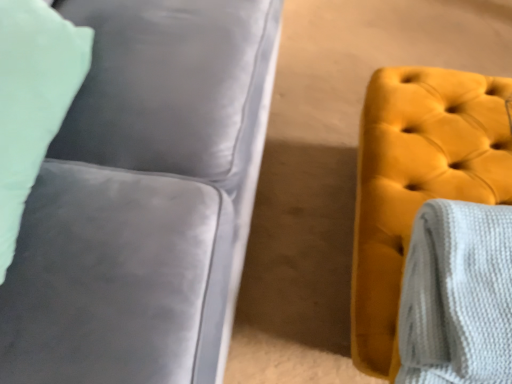
What do you see at coordinates (457, 295) in the screenshot? This screenshot has height=384, width=512. I see `white textured blanket at right` at bounding box center [457, 295].

Measure the distance between white textured blanket at right and camera.

27.69 inches.

At what (x,y) coordinates should I click in order to perform the action: click on velvet yellow ottoman at right. Please return your answer as a coordinate pair (x, y). The height and width of the screenshot is (384, 512). Looking at the image, I should click on (417, 183).

This screenshot has width=512, height=384. I want to click on furniture below the satin gray couch at left (from the image's perspective), so click(x=417, y=183).

Is velvet yellow ottoman at right positioned with its back to satin gray couch at left?

No, satin gray couch at left is not at the back of velvet yellow ottoman at right.

How different are the orientations of velvet yellow ottoman at right and satin gray couch at left in degrees?

88 degrees.

How distant is velvet yellow ottoman at right from white textured blanket at right?

A distance of 18.38 centimeters exists between velvet yellow ottoman at right and white textured blanket at right.

Considering the relative positions of velvet yellow ottoman at right and white textured blanket at right in the image provided, is velvet yellow ottoman at right to the right of white textured blanket at right from the viewer's perspective?

Yes.

From the image's perspective, which object appears higher, velvet yellow ottoman at right or white textured blanket at right?

velvet yellow ottoman at right.

You are a GUI agent. You are given a task and a screenshot of the screen. Output one action in this format:
    pyautogui.click(x=<x>, y=<y>)
    Task: Click on the blanket located above the velvet yellow ottoman at right (from a real-world perspective)
    The height and width of the screenshot is (384, 512).
    Given the screenshot: What is the action you would take?
    pyautogui.click(x=457, y=295)

From the picture: Is satin gray couch at left not within velvet yellow ottoman at right?

Indeed, satin gray couch at left is completely outside velvet yellow ottoman at right.

Between satin gray couch at left and velvet yellow ottoman at right, which one appears on the left side from the viewer's perspective?

satin gray couch at left is more to the left.

How much distance is there between satin gray couch at left and velvet yellow ottoman at right?

satin gray couch at left is 18.04 inches away from velvet yellow ottoman at right.

Considering the sizes of satin gray couch at left and velvet yellow ottoman at right in the image, is satin gray couch at left taller or shorter than velvet yellow ottoman at right?

Clearly, satin gray couch at left is taller compared to velvet yellow ottoman at right.

From a real-world perspective, is white textured blanket at right positioned under satin gray couch at left based on gravity?

Yes.

Does point (475, 325) lie behind point (78, 2)?

No, it is in front of (78, 2).

Between white textured blanket at right and satin gray couch at left, which one appears on the right side from the viewer's perspective?

white textured blanket at right is more to the right.

What's the angular difference between white textured blanket at right and velvet yellow ottoman at right's facing directions?

The facing directions of white textured blanket at right and velvet yellow ottoman at right are 1.46 degrees apart.

Is white textured blanket at right at the right side of velvet yellow ottoman at right?

No.

The width and height of the screenshot is (512, 384). I want to click on blanket that appears in front of the velvet yellow ottoman at right, so click(x=457, y=295).

Considering their positions, is white textured blanket at right located in front of or behind velvet yellow ottoman at right?

In the image, white textured blanket at right appears in front of velvet yellow ottoman at right.

Could you tell me if satin gray couch at left is turned towards white textured blanket at right?

Yes, satin gray couch at left faces towards white textured blanket at right.

Who is bigger, satin gray couch at left or white textured blanket at right?

satin gray couch at left.

Is satin gray couch at left surrounding white textured blanket at right?

No, satin gray couch at left does not contain white textured blanket at right.

Can you confirm if satin gray couch at left is wider than white textured blanket at right?

Yes.

The image size is (512, 384). Find the location of `studio couch above the velvet yellow ottoman at right (from a real-world perspective)`. studio couch above the velvet yellow ottoman at right (from a real-world perspective) is located at coordinates (143, 198).

This screenshot has width=512, height=384. Identify the location of blanket in front of the velvet yellow ottoman at right. (x=457, y=295).

Based on the photo, when comparing their distances from white textured blanket at right, does velvet yellow ottoman at right or satin gray couch at left seem further?

satin gray couch at left.

Which object lies nearer to the anchor point satin gray couch at left, velvet yellow ottoman at right or white textured blanket at right?

velvet yellow ottoman at right is positioned closer to the anchor satin gray couch at left.

Which object lies nearer to the anchor point velvet yellow ottoman at right, satin gray couch at left or white textured blanket at right?

white textured blanket at right is closer to velvet yellow ottoman at right.

From the image, which object appears to be nearer to velvet yellow ottoman at right, white textured blanket at right or satin gray couch at left?

Based on the image, white textured blanket at right appears to be nearer to velvet yellow ottoman at right.

From the image, which object appears to be farther from satin gray couch at left, white textured blanket at right or velvet yellow ottoman at right?

white textured blanket at right is further to satin gray couch at left.

Looking at the image, which one is located further to white textured blanket at right, satin gray couch at left or velvet yellow ottoman at right?

The object further to white textured blanket at right is satin gray couch at left.

This screenshot has height=384, width=512. I want to click on blanket between satin gray couch at left and velvet yellow ottoman at right from left to right, so click(457, 295).